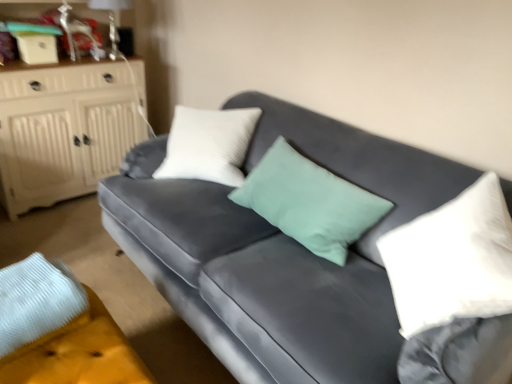
Question: Is velvet gray couch at center to the right of white wood cabinet at left from the viewer's perspective?

Choices:
 (A) yes
 (B) no

Answer: (A)

Question: Does velvet gray couch at center have a lesser height compared to white wood cabinet at left?

Choices:
 (A) yes
 (B) no

Answer: (A)

Question: From a real-world perspective, is velvet gray couch at center below white wood cabinet at left?

Choices:
 (A) yes
 (B) no

Answer: (A)

Question: Is velvet gray couch at center looking in the opposite direction of white wood cabinet at left?

Choices:
 (A) no
 (B) yes

Answer: (A)

Question: Is velvet gray couch at center at the left side of white wood cabinet at left?

Choices:
 (A) no
 (B) yes

Answer: (A)

Question: Does velvet gray couch at center come behind white wood cabinet at left?

Choices:
 (A) yes
 (B) no

Answer: (B)

Question: Does white soft pillow at right turn towards velvet yellow footrest at lower left?

Choices:
 (A) yes
 (B) no

Answer: (A)

Question: Is white soft pillow at right wider than velvet yellow footrest at lower left?

Choices:
 (A) yes
 (B) no

Answer: (B)

Question: Considering the relative sizes of white soft pillow at right and velvet yellow footrest at lower left in the image provided, is white soft pillow at right smaller than velvet yellow footrest at lower left?

Choices:
 (A) yes
 (B) no

Answer: (B)

Question: Considering the relative sizes of white soft pillow at right and velvet yellow footrest at lower left in the image provided, is white soft pillow at right bigger than velvet yellow footrest at lower left?

Choices:
 (A) yes
 (B) no

Answer: (A)

Question: From a real-world perspective, is white soft pillow at right positioned under velvet yellow footrest at lower left based on gravity?

Choices:
 (A) yes
 (B) no

Answer: (B)

Question: Is the position of white soft pillow at right more distant than that of velvet yellow footrest at lower left?

Choices:
 (A) yes
 (B) no

Answer: (B)

Question: From a real-world perspective, is velvet yellow footrest at lower left located higher than white soft pillow at right?

Choices:
 (A) no
 (B) yes

Answer: (A)